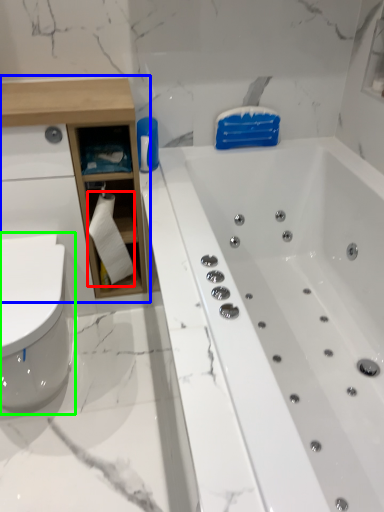
Question: Which object is positioned farthest from toilet paper (highlighted by a red box)? Select from cabinetry (highlighted by a blue box) and toilet (highlighted by a green box).

Choices:
 (A) cabinetry
 (B) toilet

Answer: (B)